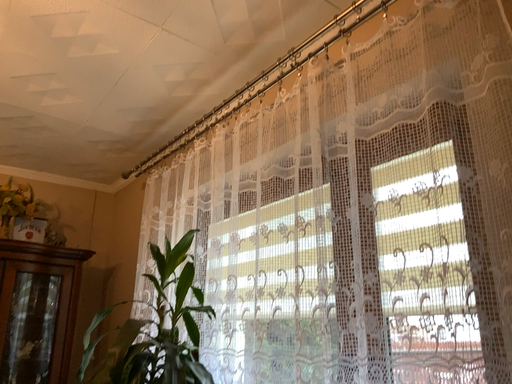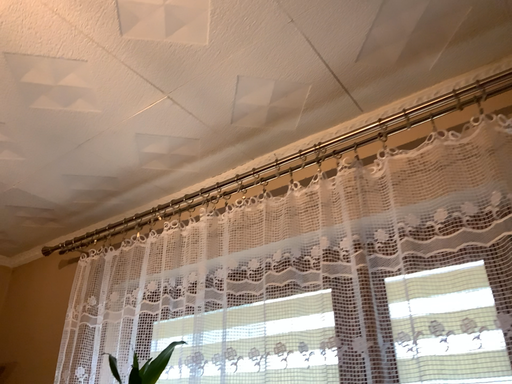
Question: How did the camera likely rotate when shooting the video?

Choices:
 (A) rotated right
 (B) rotated left

Answer: (A)